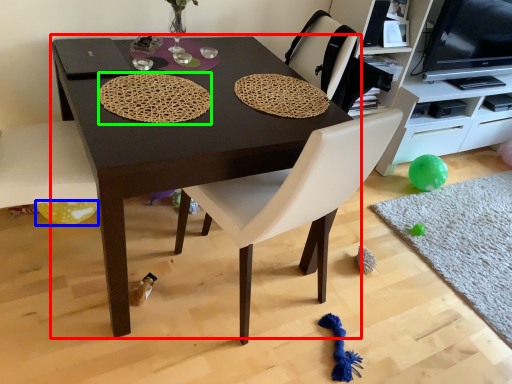
Question: Considering the real-world distances, which object is farthest from table (highlighted by a red box)? balloon (highlighted by a blue box) or mat (highlighted by a green box)?

Choices:
 (A) balloon
 (B) mat

Answer: (A)